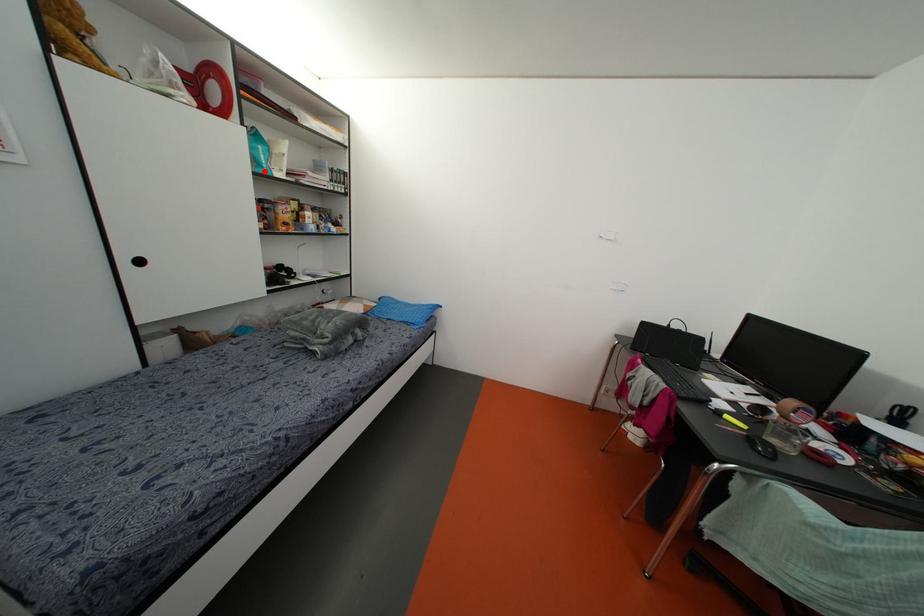
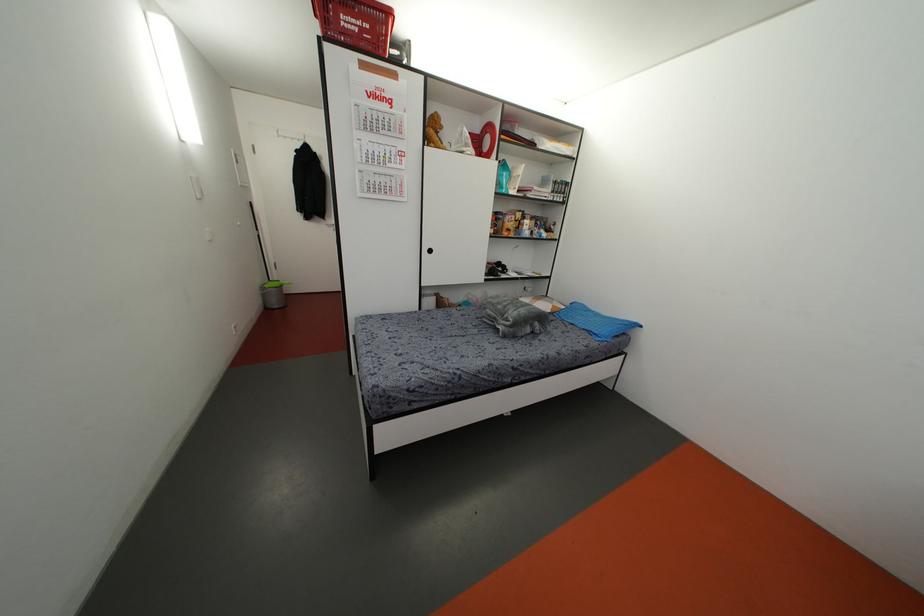
Question: I am providing you with two images of the same scene from different viewpoints. Image1 has a red point marked. In image2, the corresponding 3D location appears at what relative position? Reply with the corresponding letter.

Choices:
 (A) Closer
 (B) Farther

Answer: (A)